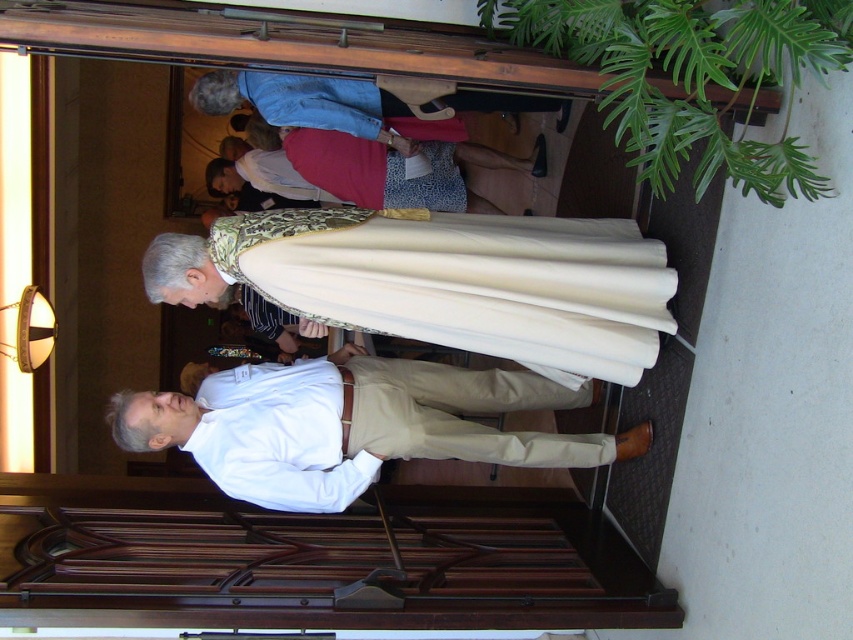
Which is behind, point (270, 467) or point (421, 195)?

Point (421, 195)

Can you confirm if white cotton shirt at center is positioned to the right of matte gold robe at center?

Yes, white cotton shirt at center is to the right of matte gold robe at center.

Which is behind, point (253, 420) or point (305, 141)?

Positioned behind is point (305, 141).

I want to click on white cotton shirt at center, so click(x=352, y=426).

Can you confirm if khaki pants at center is positioned above matte gold robe at center?

No.

Can you confirm if khaki pants at center is positioned below matte gold robe at center?

Indeed, khaki pants at center is positioned under matte gold robe at center.

Is point (549, 269) behind point (309, 160)?

No, it is in front of (309, 160).

The width and height of the screenshot is (853, 640). Identify the location of khaki pants at center. (463, 282).

Which is more to the left, khaki pants at center or white cotton shirt at center?

Positioned to the left is white cotton shirt at center.

Describe the element at coordinates (463, 282) in the screenshot. The height and width of the screenshot is (640, 853). I see `khaki pants at center` at that location.

The height and width of the screenshot is (640, 853). Find the location of `khaki pants at center`. khaki pants at center is located at coordinates (463, 282).